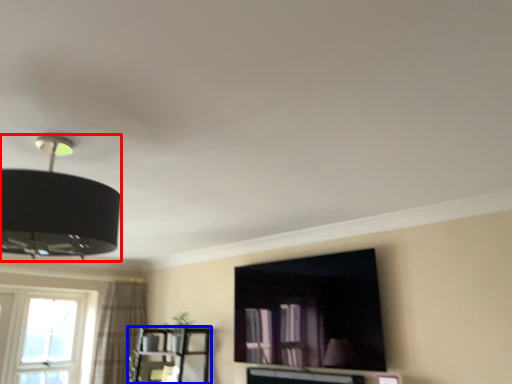
Question: Which of the following is the closest to the observer, lamp (highlighted by a red box) or entertainment center (highlighted by a blue box)?

Choices:
 (A) lamp
 (B) entertainment center

Answer: (A)